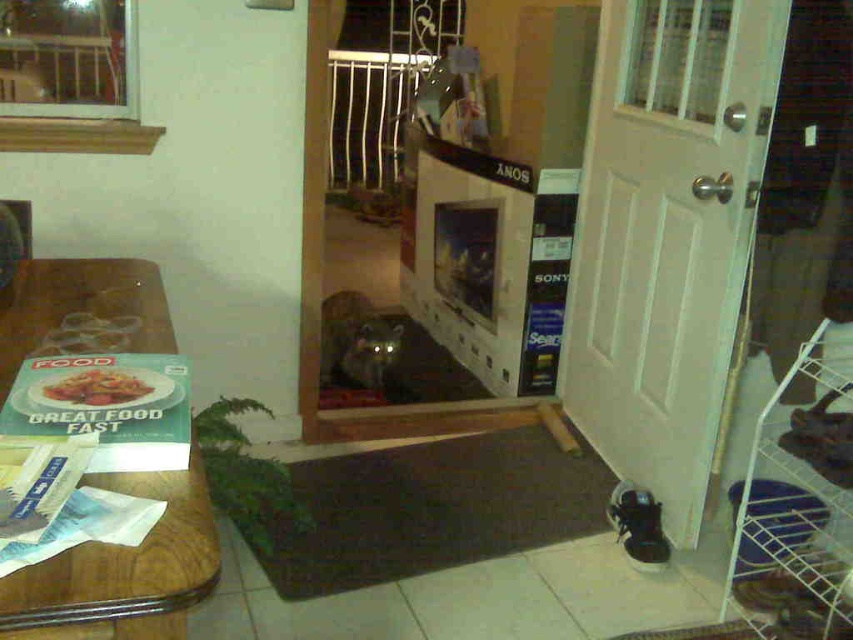
Who is taller, white wood door at right or wooden table at left?

Standing taller between the two is white wood door at right.

Which of these two, white wood door at right or wooden table at left, stands shorter?

Standing shorter between the two is wooden table at left.

Between point (701, 246) and point (93, 348), which one is positioned in front?

Point (93, 348) is in front.

Image resolution: width=853 pixels, height=640 pixels. What are the coordinates of `white wood door at right` in the screenshot? It's located at (666, 236).

Can you confirm if wooden table at left is wider than matte paper book at left?

Indeed, wooden table at left has a greater width compared to matte paper book at left.

Measure the distance from wooden table at left to matte paper book at left.

They are 10.93 inches apart.

Is point (22, 301) positioned after point (109, 394)?

Yes, it is behind point (109, 394).

Find the location of a particular element. The width and height of the screenshot is (853, 640). wooden table at left is located at coordinates (123, 572).

Does white wood door at right appear on the left side of matte paper book at left?

No, white wood door at right is not to the left of matte paper book at left.

Is point (577, 292) closer to viewer compared to point (51, 390)?

No, it is not.

Does point (590, 168) lie behind point (54, 397)?

Yes, it is.

Where is `white wood door at right`? This screenshot has width=853, height=640. white wood door at right is located at coordinates (666, 236).